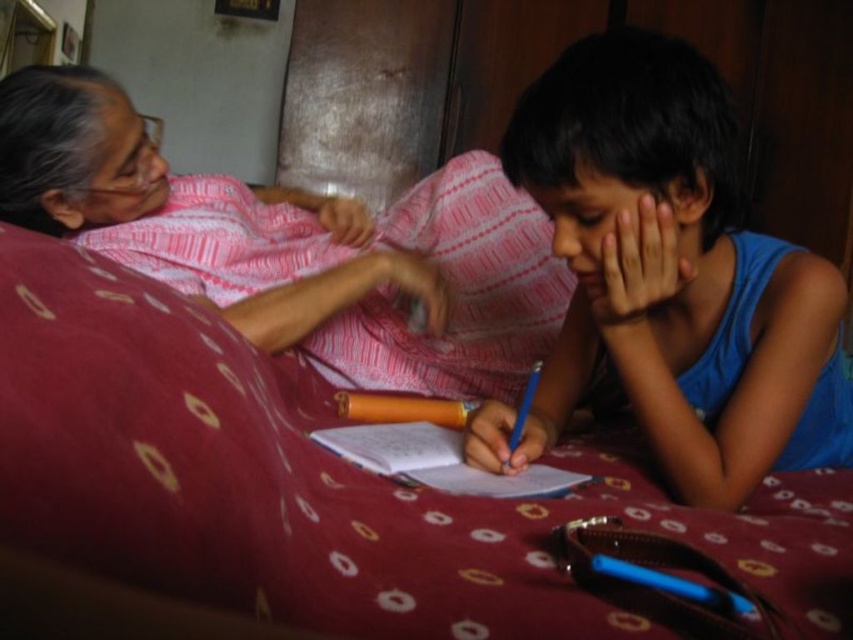
Between maroon fabric bed at center and matte pink fabric at upper left, which one is positioned higher?

matte pink fabric at upper left

Find the location of a particular element. The width and height of the screenshot is (853, 640). maroon fabric bed at center is located at coordinates click(320, 483).

At what (x,y) coordinates should I click in order to perform the action: click on maroon fabric bed at center. Please return your answer as a coordinate pair (x, y). Looking at the image, I should click on (320, 483).

Based on the photo, who is more distant from viewer, (x=299, y=460) or (x=547, y=401)?

Positioned behind is point (x=547, y=401).

Is maroon fabric bed at center further to the viewer compared to blue matte shirt at center?

No, it is in front of blue matte shirt at center.

Does point (815, 598) lie in front of point (627, 198)?

Yes, it is.

Find the location of `maroon fabric bed at center`. maroon fabric bed at center is located at coordinates (320, 483).

Is blue matte shirt at center to the left of matte pink fabric at upper left from the viewer's perspective?

Incorrect, blue matte shirt at center is not on the left side of matte pink fabric at upper left.

Who is positioned more to the right, blue matte shirt at center or matte pink fabric at upper left?

Positioned to the right is blue matte shirt at center.

Does point (729, 336) lie behind point (123, 182)?

No, it is in front of (123, 182).

Find the location of a particular element. blue matte shirt at center is located at coordinates (670, 276).